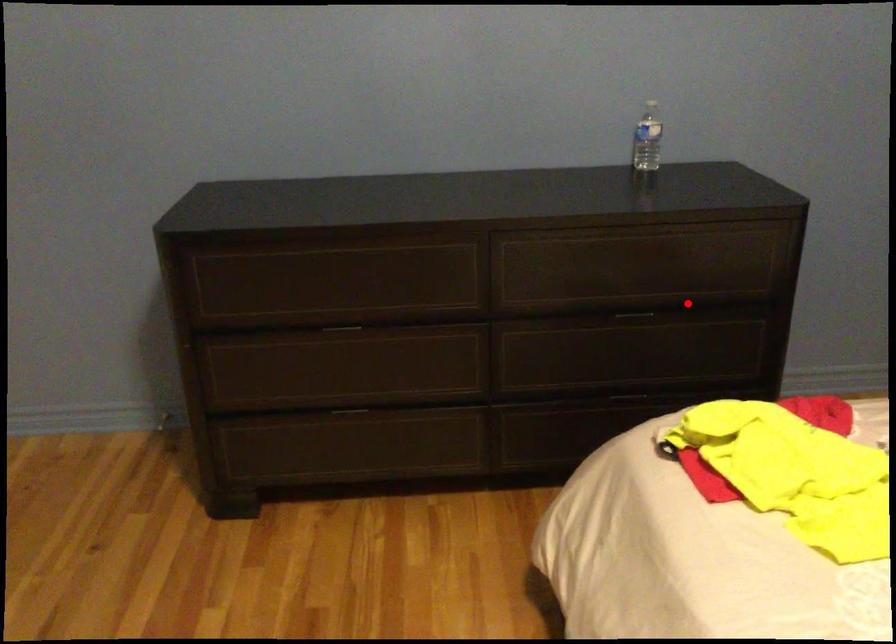
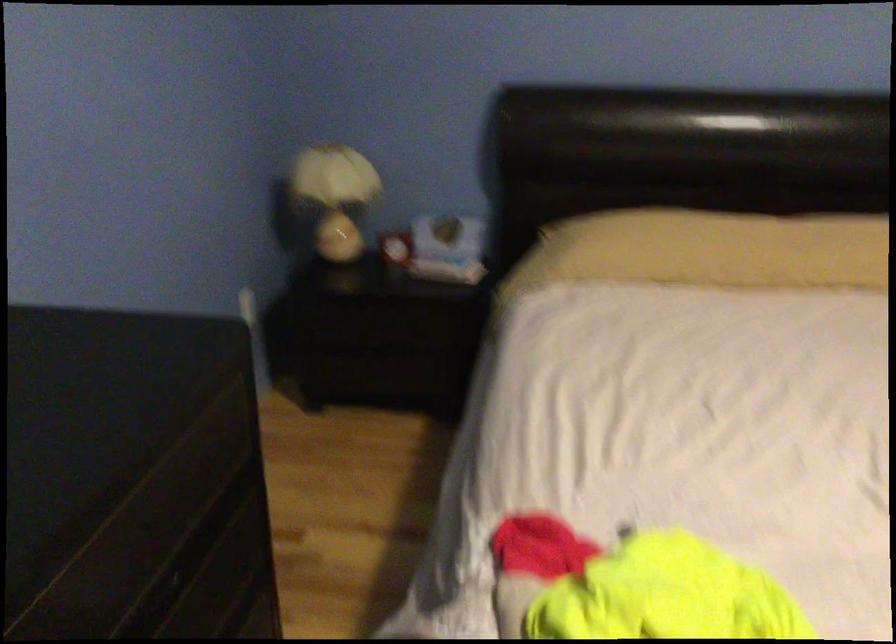
Find the pixel in the second image that matches the highlighted location in the first image.

(186, 559)